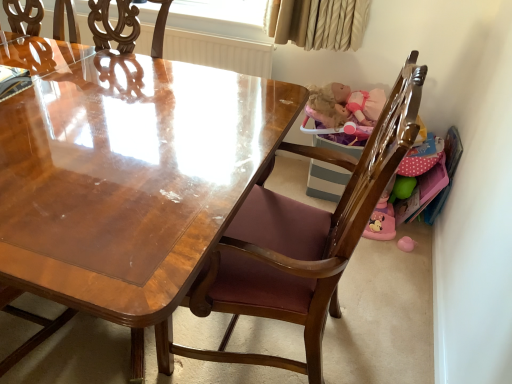
This screenshot has width=512, height=384. I want to click on transparent plastic window screen at upper center, so click(x=224, y=10).

The width and height of the screenshot is (512, 384). Describe the element at coordinates (224, 10) in the screenshot. I see `transparent plastic window screen at upper center` at that location.

The image size is (512, 384). I want to click on mahogany wood chair at center, so click(300, 241).

What do you see at coordinates (300, 241) in the screenshot? I see `mahogany wood chair at center` at bounding box center [300, 241].

You are a GUI agent. You are given a task and a screenshot of the screen. Output one action in this format:
    pyautogui.click(x=<x>, y=<y>)
    Task: Click on the transparent plastic window screen at upper center
    Image resolution: width=512 pixels, height=384 pixels.
    Given the screenshot: What is the action you would take?
    pyautogui.click(x=224, y=10)

Considering the positions of objects mahogany wood chair at center and transparent plastic window screen at upper center in the image provided, who is more to the right, mahogany wood chair at center or transparent plastic window screen at upper center?

From the viewer's perspective, mahogany wood chair at center appears more on the right side.

Is mahogany wood chair at center in front of transparent plastic window screen at upper center?

Yes, mahogany wood chair at center is closer to the camera.

Considering the positions of points (206, 267) and (234, 19), is point (206, 267) closer to camera compared to point (234, 19)?

Yes, point (206, 267) is in front of point (234, 19).

From the image's perspective, is mahogany wood chair at center located above transparent plastic window screen at upper center?

No, from the image's perspective, mahogany wood chair at center is not above transparent plastic window screen at upper center.

From a real-world perspective, is mahogany wood chair at center physically above transparent plastic window screen at upper center?

No, from a real-world perspective, mahogany wood chair at center is not above transparent plastic window screen at upper center.

Which of these two, mahogany wood chair at center or transparent plastic window screen at upper center, is thinner?

transparent plastic window screen at upper center.

Is mahogany wood chair at center taller than transparent plastic window screen at upper center?

Indeed, mahogany wood chair at center has a greater height compared to transparent plastic window screen at upper center.

Does mahogany wood chair at center have a smaller size compared to transparent plastic window screen at upper center?

No, mahogany wood chair at center is not smaller than transparent plastic window screen at upper center.

Is transparent plastic window screen at upper center located within mahogany wood chair at center?

No, transparent plastic window screen at upper center is not surrounded by mahogany wood chair at center.

Does mahogany wood chair at center touch transparent plastic window screen at upper center?

There is a gap between mahogany wood chair at center and transparent plastic window screen at upper center.

Is mahogany wood chair at center facing away from transparent plastic window screen at upper center?

No, mahogany wood chair at center is not facing away from transparent plastic window screen at upper center.

What's the angular difference between mahogany wood chair at center and transparent plastic window screen at upper center's facing directions?

The angle between the facing direction of mahogany wood chair at center and the facing direction of transparent plastic window screen at upper center is 88.4 degrees.

This screenshot has height=384, width=512. In order to click on window screen that appears above the mahogany wood chair at center (from the image's perspective) in this screenshot , I will do `click(224, 10)`.

Considering the relative positions of transparent plastic window screen at upper center and mahogany wood chair at center in the image provided, is transparent plastic window screen at upper center to the right of mahogany wood chair at center from the viewer's perspective?

No, transparent plastic window screen at upper center is not to the right of mahogany wood chair at center.

Is the depth of transparent plastic window screen at upper center greater than that of mahogany wood chair at center?

Yes, transparent plastic window screen at upper center is further from the viewer.

Considering the positions of point (220, 4) and point (408, 72), is point (220, 4) closer or farther from the camera than point (408, 72)?

Point (220, 4) is farther from the camera than point (408, 72).

From the image's perspective, which one is positioned lower, transparent plastic window screen at upper center or mahogany wood chair at center?

From the image's view, mahogany wood chair at center is below.

From a real-world perspective, is transparent plastic window screen at upper center under mahogany wood chair at center?

No, from a real-world perspective, transparent plastic window screen at upper center is not below mahogany wood chair at center.

Which of these two, transparent plastic window screen at upper center or mahogany wood chair at center, is wider?

mahogany wood chair at center is wider.

Can you confirm if transparent plastic window screen at upper center is shorter than mahogany wood chair at center?

Yes, transparent plastic window screen at upper center is shorter than mahogany wood chair at center.

Who is bigger, transparent plastic window screen at upper center or mahogany wood chair at center?

Bigger between the two is mahogany wood chair at center.

Do you think transparent plastic window screen at upper center is within mahogany wood chair at center, or outside of it?

The correct answer is: outside.

Is there a large distance between transparent plastic window screen at upper center and mahogany wood chair at center?

Yes, transparent plastic window screen at upper center and mahogany wood chair at center are located far from each other.

Is transparent plastic window screen at upper center aimed at mahogany wood chair at center?

No.

What's the angular difference between transparent plastic window screen at upper center and mahogany wood chair at center's facing directions?

88.4 degrees.

Where is `chair in front of the transparent plastic window screen at upper center`? The image size is (512, 384). chair in front of the transparent plastic window screen at upper center is located at coordinates (300, 241).

The image size is (512, 384). Identify the location of window screen that appears on the left of mahogany wood chair at center. (224, 10).

This screenshot has width=512, height=384. In order to click on chair below the transparent plastic window screen at upper center (from a real-world perspective) in this screenshot , I will do `click(300, 241)`.